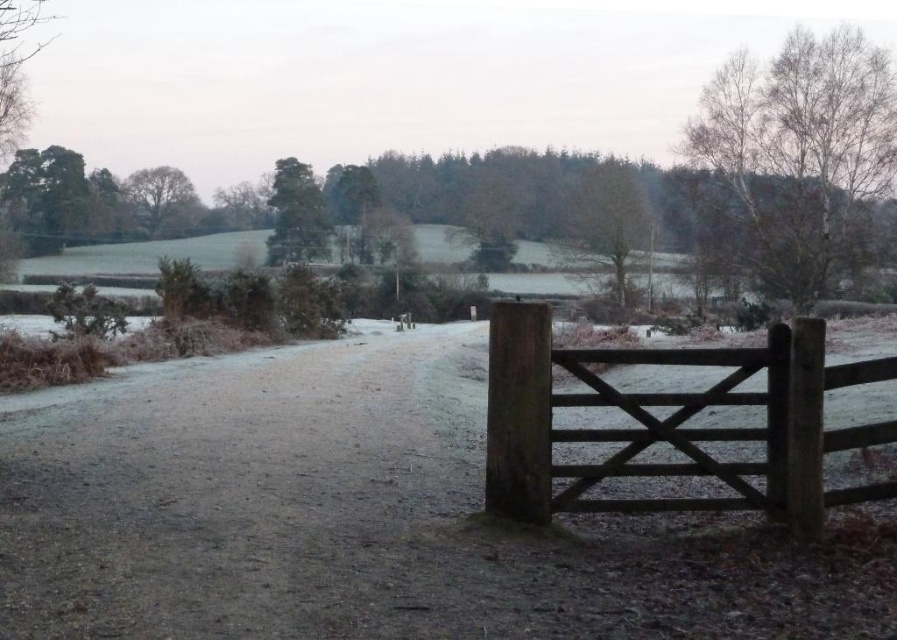
Question: Can you confirm if green textured tree at upper center is wider than green leafy tree at upper left?

Choices:
 (A) yes
 (B) no

Answer: (B)

Question: Does frosted gravel path at center appear over green leafy tree at upper left?

Choices:
 (A) yes
 (B) no

Answer: (B)

Question: Among these points, which one is nearest to the camera?

Choices:
 (A) (816, 241)
 (B) (292, 198)
 (C) (140, 205)

Answer: (A)

Question: Which point is farther from the camera taking this photo?

Choices:
 (A) (811, 488)
 (B) (190, 394)

Answer: (B)

Question: From the image, what is the correct spatial relationship of bare birch tree at upper right in relation to green textured tree at upper center?

Choices:
 (A) right
 (B) left

Answer: (A)

Question: Which of these objects is positioned closest to the bare birch tree at upper right?

Choices:
 (A) green leafy tree at upper left
 (B) green textured tree at upper center
 (C) frosted gravel path at center
 (D) wooden gate at right

Answer: (B)